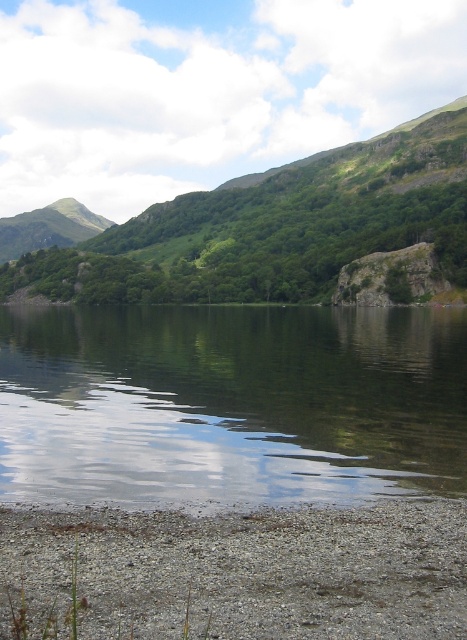
Is point (284, 410) positioned in front of point (246, 634)?

No, (284, 410) is behind (246, 634).

Is transparent water at center smaller than gray gravel at lower left?

Actually, transparent water at center might be larger than gray gravel at lower left.

Is point (233, 435) positioned before point (207, 598)?

That is False.

Locate an element on the screen. The image size is (467, 640). transparent water at center is located at coordinates (231, 403).